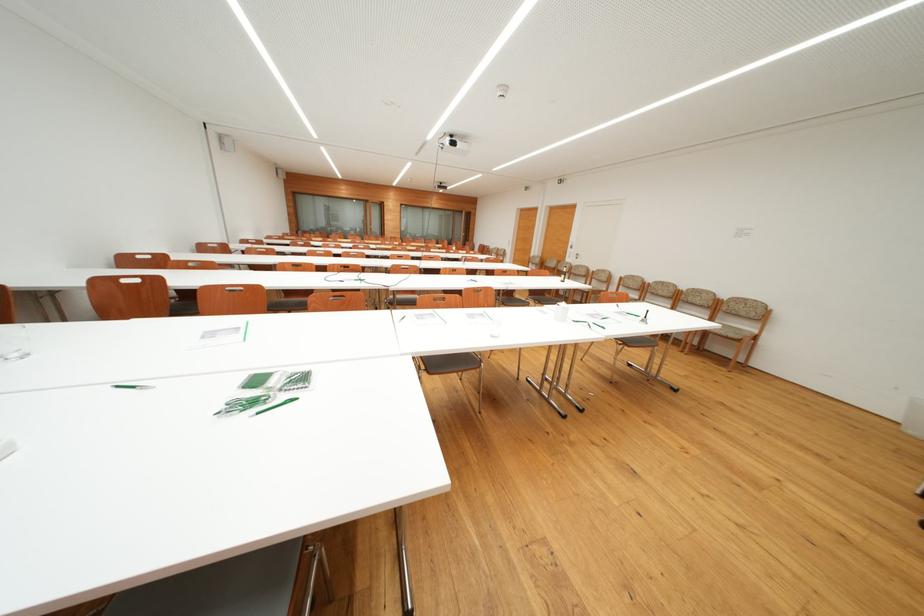
Find the location of a particular element. wooden door handle is located at coordinates (599, 260).